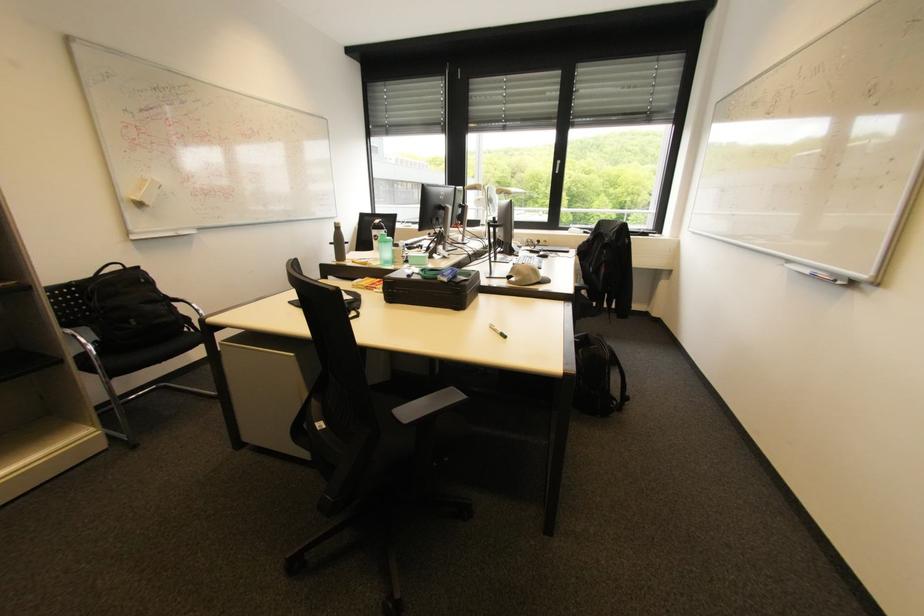
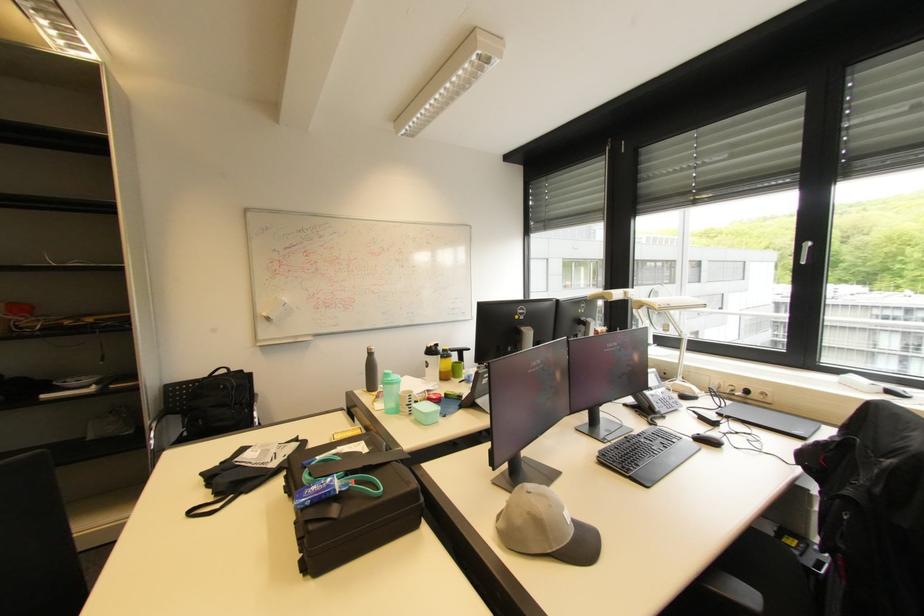
The point at (x=146, y=205) is marked in the first image. Where is the corresponding point in the second image?

(273, 320)